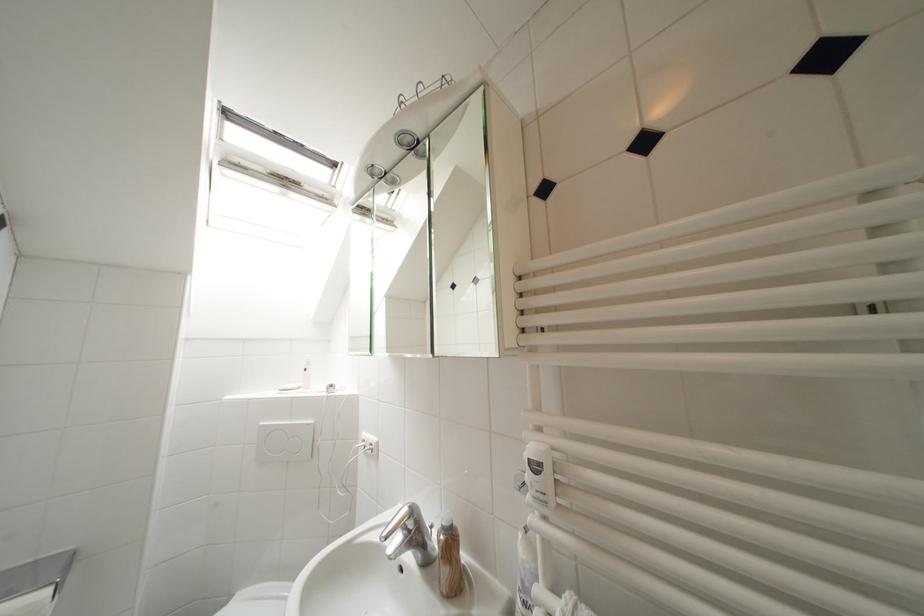
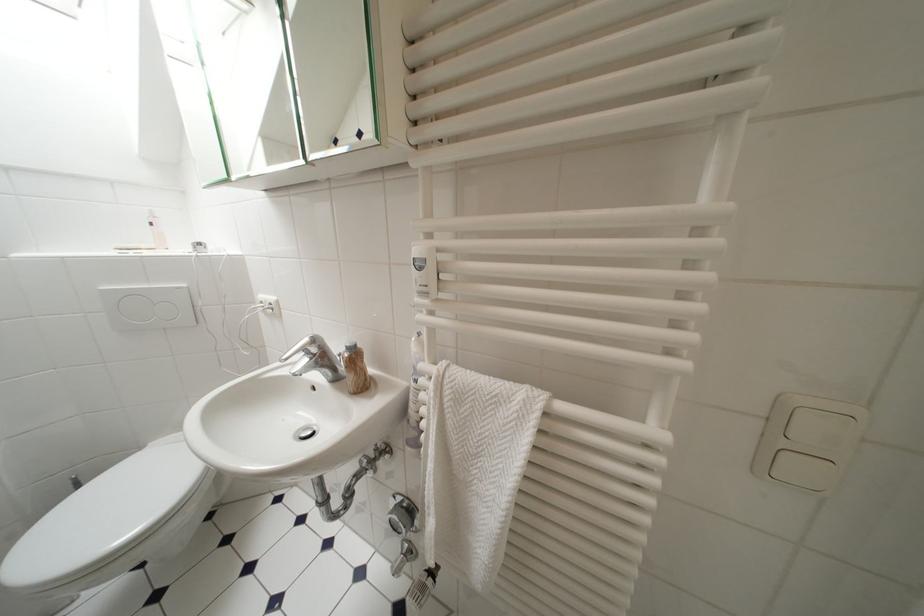
Find the pixel in the second image that matches [451,525] in the first image.

(355, 347)